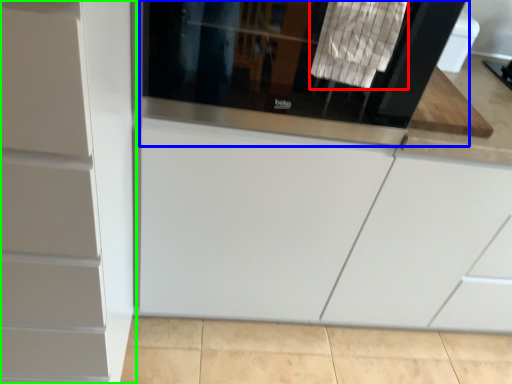
Question: Which object is the closest to the laundry (highlighted by a red box)? Choose among these: screen door (highlighted by a blue box) or cabinetry (highlighted by a green box).

Choices:
 (A) screen door
 (B) cabinetry

Answer: (A)